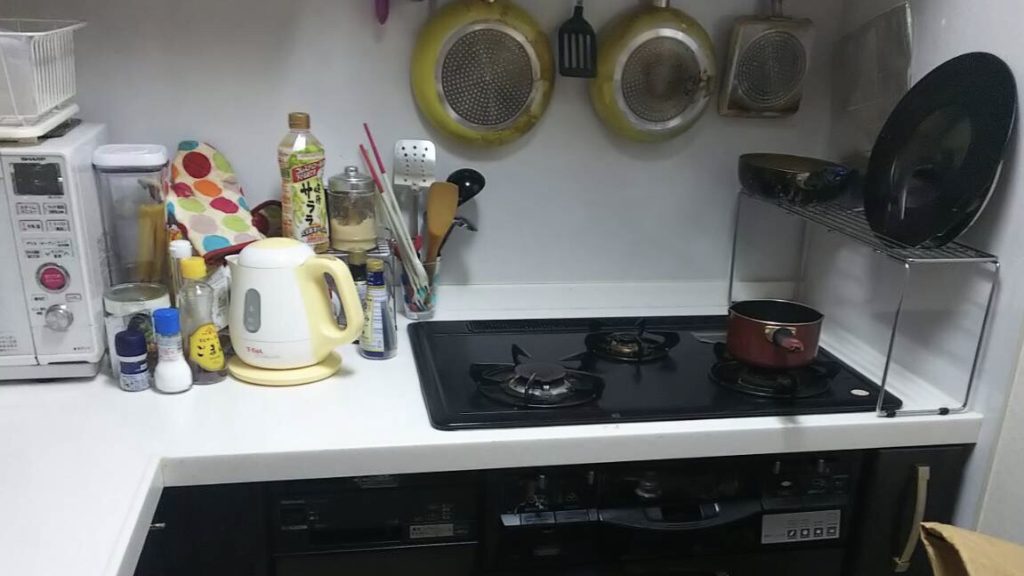
Find the location of `pot holder`. pot holder is located at coordinates (228, 203).